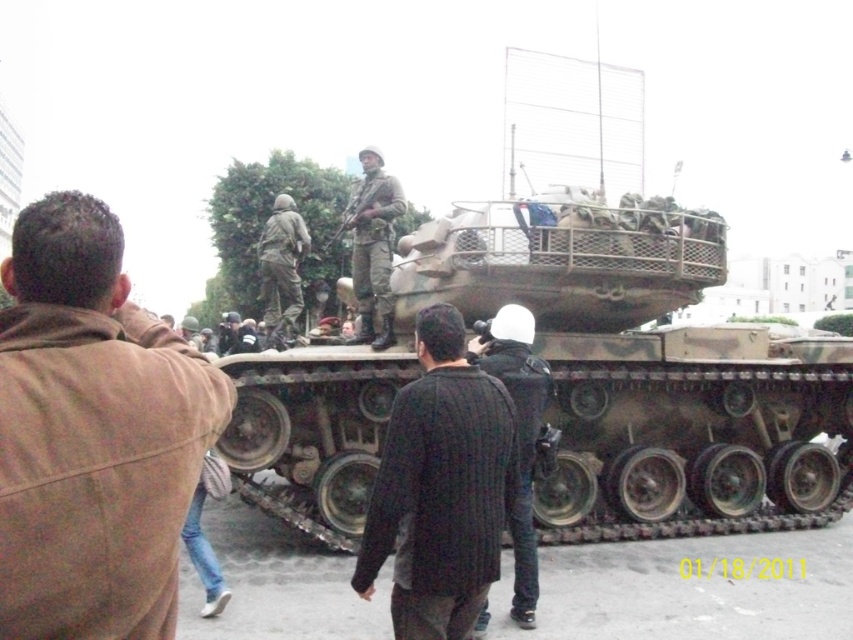
You are a photographer trying to capture a group photo of the two people in the scene. You want to arrange them so that the person in the brown leather jacket at upper left is on the left side of the photo and the person in the black ribbed sweater at center is on the right side. Based on their current positions, is this arrangement possible without moving them?

Yes, the arrangement is possible because the brown leather jacket at upper left is already positioned to the left of the black ribbed sweater at center, which aligns with your desired setup.

You are a photographer trying to capture a clear shot of the black ribbed sweater at center and the camouflage fabric soldier at center. Based on their positions, which object is closer to the camera?

The black ribbed sweater at center is in front of the camouflage fabric soldier at center, so the black ribbed sweater at center is closer to the camera.